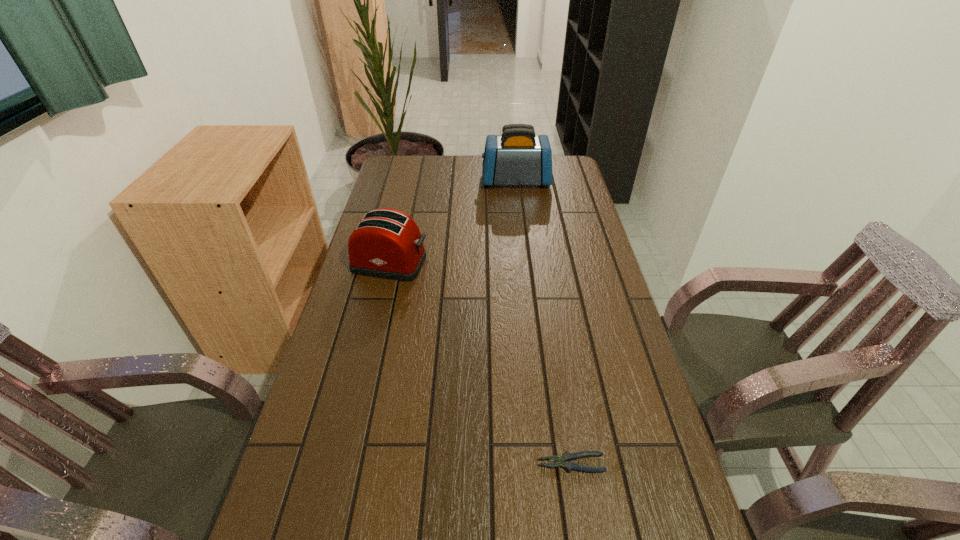
This screenshot has height=540, width=960. I want to click on the taller toaster, so click(517, 157).

Image resolution: width=960 pixels, height=540 pixels. Find the location of `the tallest object`. the tallest object is located at coordinates (517, 157).

The image size is (960, 540). Identify the location of the shorter toaster. (387, 243).

This screenshot has width=960, height=540. I want to click on the left toaster, so click(x=387, y=243).

Locate an element on the screen. the shortest object is located at coordinates (564, 461).

Image resolution: width=960 pixels, height=540 pixels. Identify the location of pliers. pyautogui.click(x=564, y=461).

Where is `vacant region located on the front-facing side of the tallest object`? vacant region located on the front-facing side of the tallest object is located at coordinates pyautogui.click(x=393, y=181).

At what (x,y) coordinates should I click in order to perform the action: click on blank space located on the front-facing side of the tallest object. Please return your answer as a coordinate pair (x, y). Looking at the image, I should click on (427, 181).

Locate an element on the screen. This screenshot has height=540, width=960. free location located 0.270m on the front-facing side of the tallest object is located at coordinates (415, 181).

The image size is (960, 540). I want to click on blank space located 0.230m on the back of the left toaster, so click(x=403, y=208).